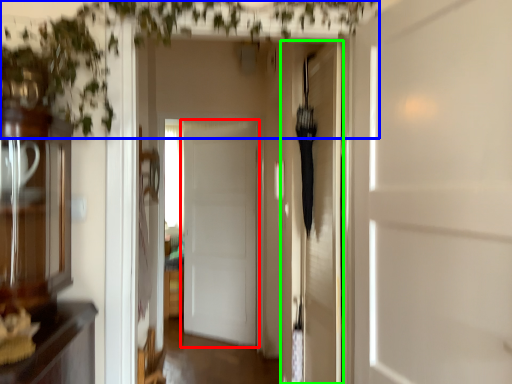
Question: Considering the real-world distances, which object is closest to door (highlighted by a red box)? vegetation (highlighted by a blue box) or door (highlighted by a green box).

Choices:
 (A) vegetation
 (B) door

Answer: (B)